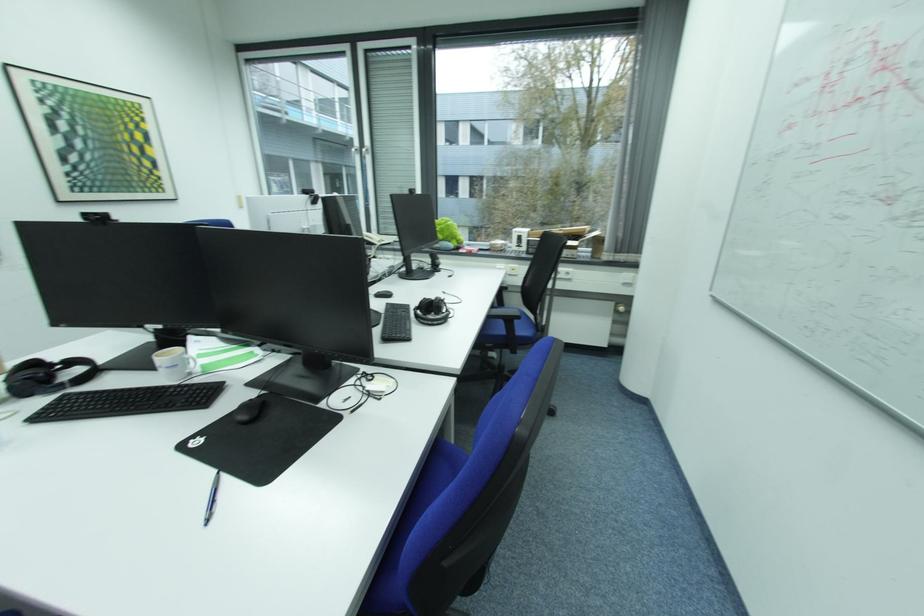
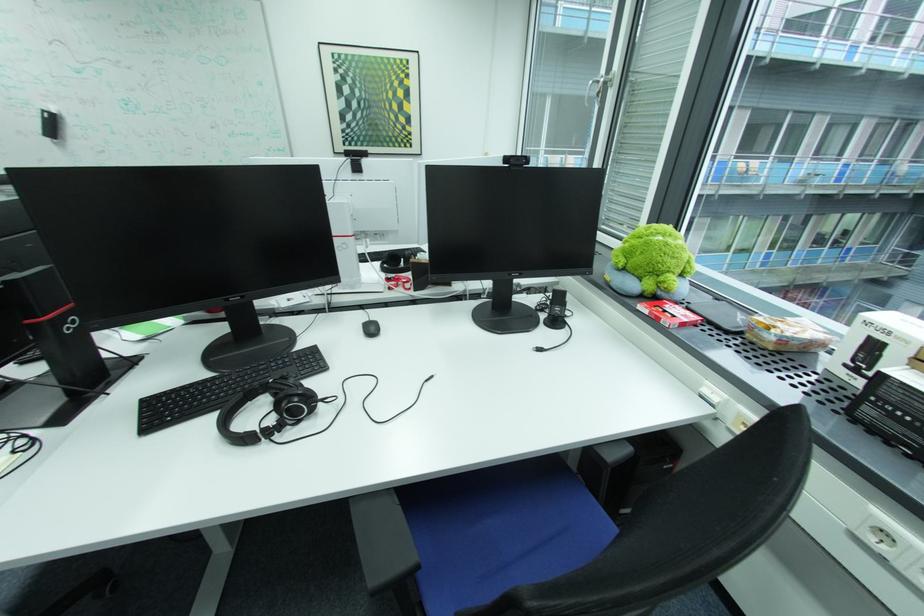
Find the pixel in the second image that matches point (465, 249) in the first image.

(659, 297)